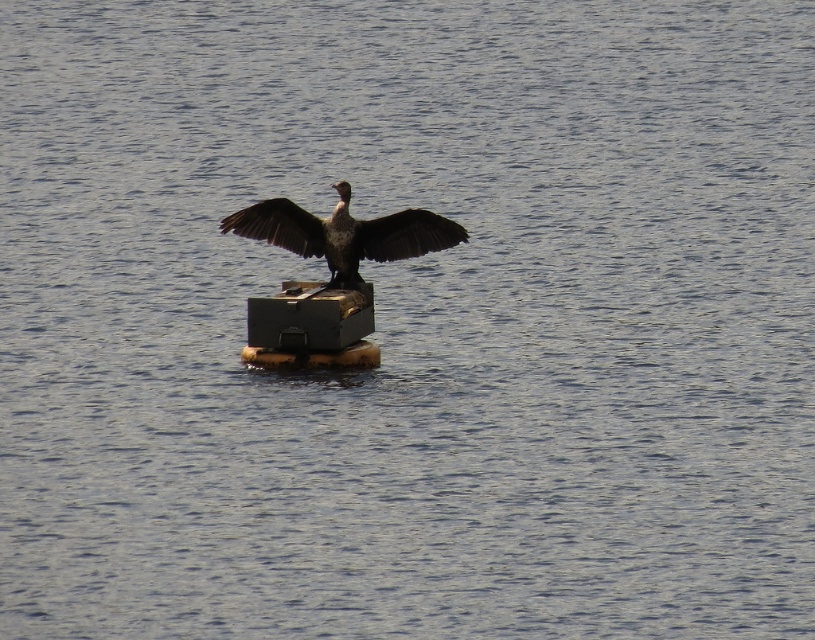
Can you confirm if dark brown feathers at center is positioned to the left of dark brown feathered wing at center?

Incorrect, dark brown feathers at center is not on the left side of dark brown feathered wing at center.

Can you confirm if dark brown feathers at center is thinner than dark brown feathered wing at center?

No.

Is point (443, 237) closer to camera compared to point (250, 205)?

That is True.

Find the location of a particular element. The width and height of the screenshot is (815, 640). dark brown feathers at center is located at coordinates (344, 234).